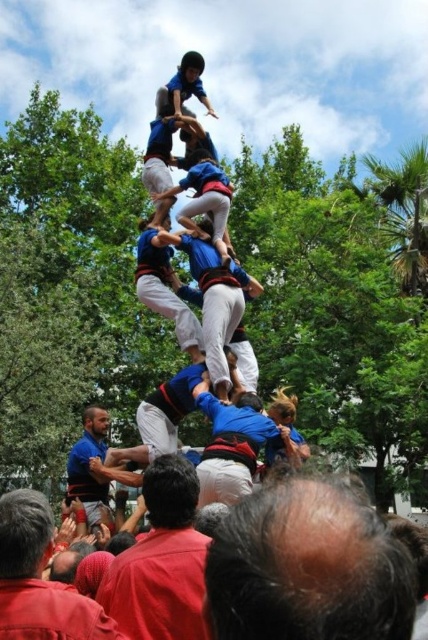
You are a safety officer at the event and need to ensure that the dark blue shirt at center and the red shirt at lower left are within a 5 meter safety zone. Based on the image, are they within the required distance?

The dark blue shirt at center and the red shirt at lower left are 4.24 meters apart, which is within the 5 meter safety zone.

You are a photographer at the event and want to capture the bald head at center and dark blue shirt at center in the same frame. Which one of these two will be closer to the camera?

The bald head at center is not as tall as dark blue shirt at center, so the dark blue shirt at center is taller and thus closer to the camera.